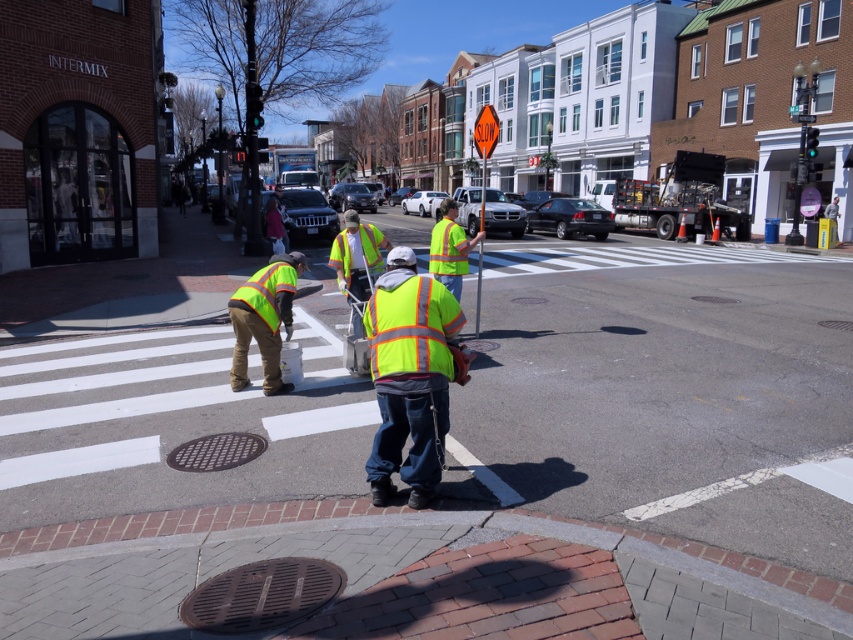
Which is above, high-visibility reflective safety vest at center or high-visibility fabric safety vest at center?

high-visibility fabric safety vest at center is above.

Locate an element on the screen. The height and width of the screenshot is (640, 853). high-visibility reflective safety vest at center is located at coordinates (410, 324).

Who is more forward, (447,316) or (447,243)?

Point (447,316) is in front.

Find the location of a particular element. high-visibility reflective safety vest at center is located at coordinates (410, 324).

Between high-visibility reflective vest at center and yellow reflective safety vest at center, which one is positioned lower?

Positioned lower is high-visibility reflective vest at center.

Is high-visibility reflective vest at center smaller than yellow reflective safety vest at center?

Actually, high-visibility reflective vest at center might be larger than yellow reflective safety vest at center.

Between point (270, 348) and point (375, 243), which one is positioned behind?

Positioned behind is point (375, 243).

Identify the location of high-visibility reflective vest at center. point(264,320).

Locate an element on the screen. high-visibility yellow vest at center is located at coordinates (409, 376).

Who is positioned more to the right, high-visibility yellow vest at center or yellow reflective safety vest at center?

high-visibility yellow vest at center is more to the right.

Between point (419, 394) and point (347, 252), which one is positioned behind?

The point (347, 252) is behind.

This screenshot has width=853, height=640. What are the coordinates of `high-visibility yellow vest at center` in the screenshot? It's located at (409, 376).